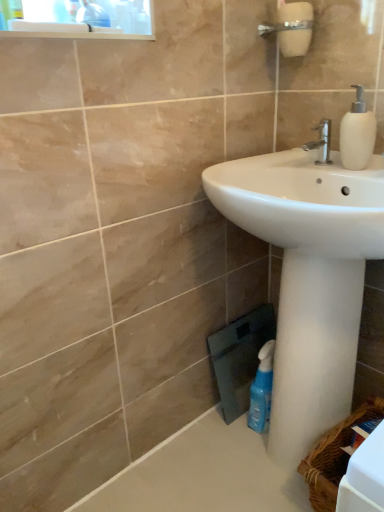
Question: Is silver metallic faucet at upper center to the right of white matte soap dispenser at upper right from the viewer's perspective?

Choices:
 (A) yes
 (B) no

Answer: (B)

Question: From a real-world perspective, does silver metallic faucet at upper center stand above white matte soap dispenser at upper right?

Choices:
 (A) yes
 (B) no

Answer: (B)

Question: Considering the relative sizes of silver metallic faucet at upper center and white matte soap dispenser at upper right in the image provided, is silver metallic faucet at upper center shorter than white matte soap dispenser at upper right?

Choices:
 (A) no
 (B) yes

Answer: (B)

Question: Does silver metallic faucet at upper center have a greater height compared to white matte soap dispenser at upper right?

Choices:
 (A) yes
 (B) no

Answer: (B)

Question: Considering the relative positions of silver metallic faucet at upper center and white matte soap dispenser at upper right in the image provided, is silver metallic faucet at upper center in front of white matte soap dispenser at upper right?

Choices:
 (A) yes
 (B) no

Answer: (B)

Question: From a real-world perspective, is silver metallic faucet at upper center under white matte soap dispenser at upper right?

Choices:
 (A) no
 (B) yes

Answer: (B)

Question: Is the depth of blue translucent bottle at lower right less than that of silver metallic faucet at upper center?

Choices:
 (A) yes
 (B) no

Answer: (B)

Question: From the image's perspective, would you say blue translucent bottle at lower right is shown under silver metallic faucet at upper center?

Choices:
 (A) no
 (B) yes

Answer: (B)

Question: Is blue translucent bottle at lower right thinner than silver metallic faucet at upper center?

Choices:
 (A) no
 (B) yes

Answer: (A)

Question: Does blue translucent bottle at lower right have a larger size compared to silver metallic faucet at upper center?

Choices:
 (A) yes
 (B) no

Answer: (A)

Question: From the image's perspective, is blue translucent bottle at lower right over silver metallic faucet at upper center?

Choices:
 (A) no
 (B) yes

Answer: (A)

Question: From a real-world perspective, is blue translucent bottle at lower right beneath silver metallic faucet at upper center?

Choices:
 (A) no
 (B) yes

Answer: (B)

Question: From a real-world perspective, is woven brown basket at lower right below white matte soap dispenser at upper right?

Choices:
 (A) yes
 (B) no

Answer: (A)